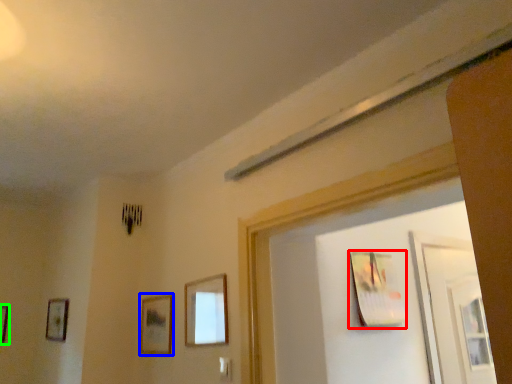
Question: Considering the real-world distances, which object is closest to picture frame (highlighted by a red box)? picture frame (highlighted by a blue box) or picture frame (highlighted by a green box).

Choices:
 (A) picture frame
 (B) picture frame

Answer: (A)